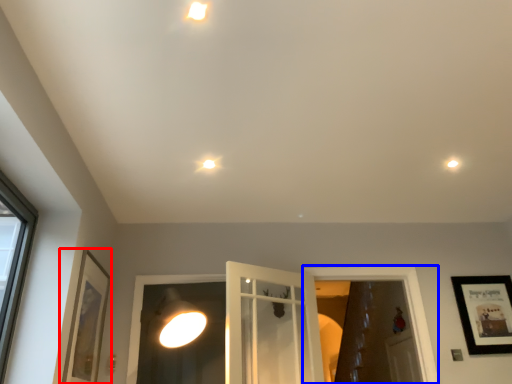
Question: Which object is closer to the camera taking this photo, picture frame (highlighted by a red box) or window frame (highlighted by a blue box)?

Choices:
 (A) picture frame
 (B) window frame

Answer: (A)